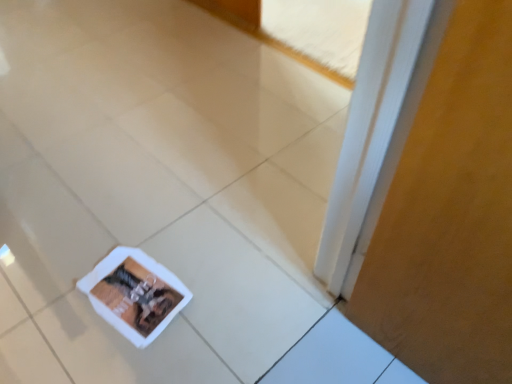
Identify the location of vacant space situated on the left part of white glossy magazine at lower left. This screenshot has width=512, height=384. (65, 302).